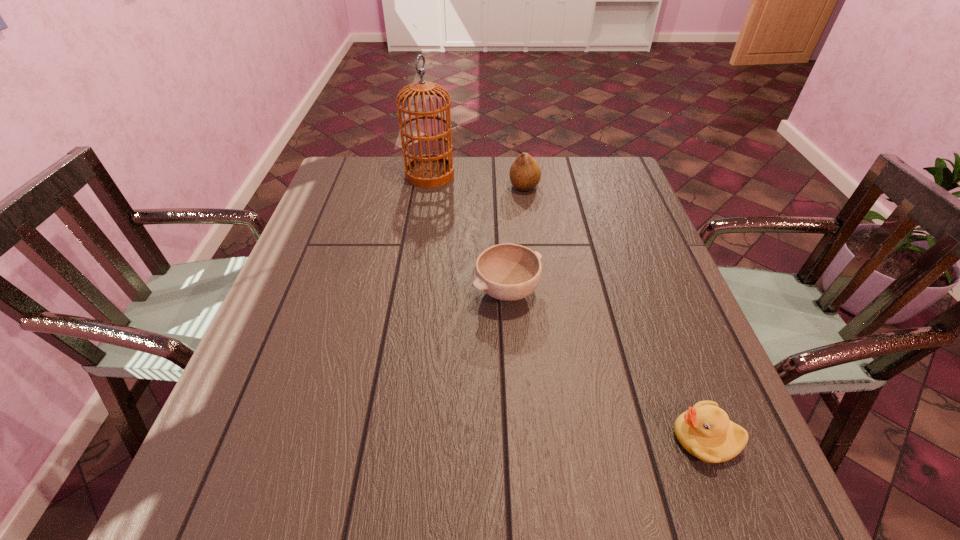
I want to click on vacant area that lies between the bowl and the tallest object, so click(468, 233).

At what (x,y) coordinates should I click in order to perform the action: click on the third closest object to the duckling. Please return your answer as a coordinate pair (x, y). Looking at the image, I should click on point(430,170).

Identify the location of object that is the third closest to the rightmost object. This screenshot has height=540, width=960. (430, 170).

This screenshot has height=540, width=960. Find the location of `vacant space that satisfies the following two spatial constraints: 1. on the front side of the bowl; 2. on the left side of the tallest object`. vacant space that satisfies the following two spatial constraints: 1. on the front side of the bowl; 2. on the left side of the tallest object is located at coordinates (412, 292).